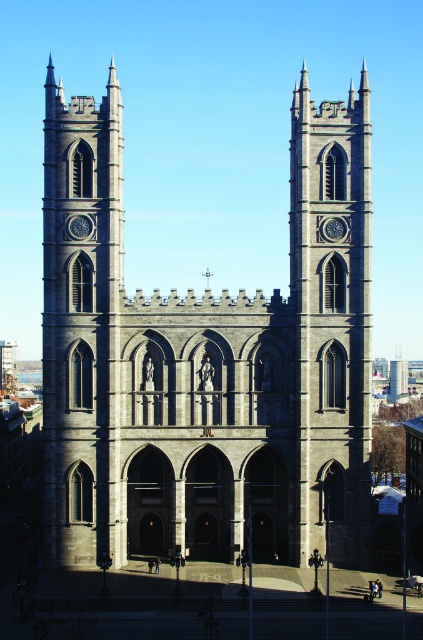
You are standing in front of the gray stone church at center and the gray stone clock tower at center. Which one is more to the left?

The gray stone church at center is more to the left side of the gray stone clock tower at center.

In the scene shown: You are an architect visiting the cathedral and want to determine which structure is taller between the gray stone church at center and the gray stone clock tower at center. Based on the cathedral layout, which one is taller?

The gray stone church at center is taller than the gray stone clock tower at center according to the cathedral layout.